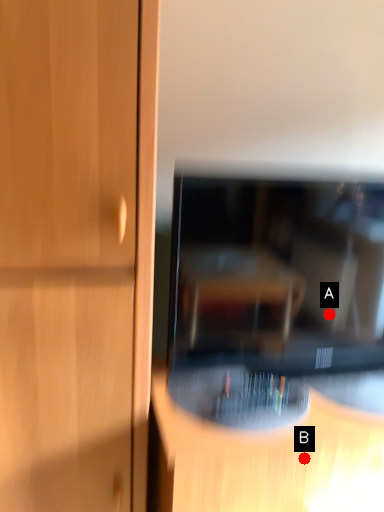
Question: Two points are circled on the image, labeled by A and B beside each circle. Which point is farther from the camera taking this photo?

Choices:
 (A) A is further
 (B) B is further

Answer: (A)